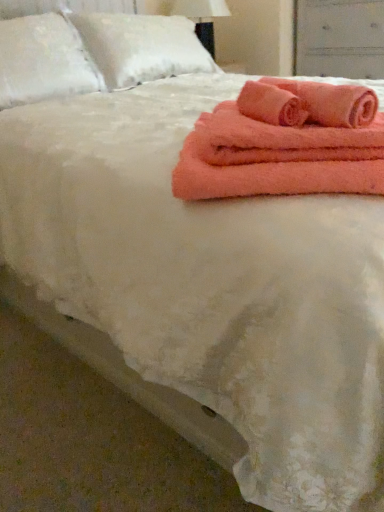
Question: Does coral plush bath towel at upper right have a smaller size compared to white fluffy pillow at upper left, placed as the 2th pillow when sorted from right to left?

Choices:
 (A) yes
 (B) no

Answer: (A)

Question: Is coral plush bath towel at upper right thinner than white fluffy pillow at upper left, placed as the 2th pillow when sorted from right to left?

Choices:
 (A) yes
 (B) no

Answer: (A)

Question: From the image's perspective, is coral plush bath towel at upper right located beneath white fluffy pillow at upper left, the 1th pillow viewed from the left?

Choices:
 (A) no
 (B) yes

Answer: (B)

Question: Does coral plush bath towel at upper right appear on the left side of white fluffy pillow at upper left, placed as the 2th pillow when sorted from right to left?

Choices:
 (A) no
 (B) yes

Answer: (A)

Question: Are coral plush bath towel at upper right and white fluffy pillow at upper left, placed as the 2th pillow when sorted from right to left, far apart?

Choices:
 (A) yes
 (B) no

Answer: (A)

Question: From a real-world perspective, is coral plush bath towel at upper right positioned over white fluffy pillow at upper left, the 1th pillow viewed from the left, based on gravity?

Choices:
 (A) yes
 (B) no

Answer: (B)

Question: From the image's perspective, is coral plush bath towel at upper right located beneath matte white drawer at upper right?

Choices:
 (A) no
 (B) yes

Answer: (B)

Question: Is matte white drawer at upper right completely or partially inside coral plush bath towel at upper right?

Choices:
 (A) no
 (B) yes

Answer: (A)

Question: Is coral plush bath towel at upper right positioned in front of matte white drawer at upper right?

Choices:
 (A) yes
 (B) no

Answer: (A)

Question: Can you confirm if coral plush bath towel at upper right is thinner than matte white drawer at upper right?

Choices:
 (A) yes
 (B) no

Answer: (A)

Question: Is coral plush bath towel at upper right at the right side of matte white drawer at upper right?

Choices:
 (A) yes
 (B) no

Answer: (B)

Question: From a real-world perspective, is coral plush bath towel at upper right on top of matte white drawer at upper right?

Choices:
 (A) no
 (B) yes

Answer: (B)

Question: Does white fluffy pillow at upper left, placed as the 2th pillow when sorted from right to left, have a lesser width compared to white fluffy pillow at upper left, placed as the second pillow when sorted from left to right?

Choices:
 (A) no
 (B) yes

Answer: (B)